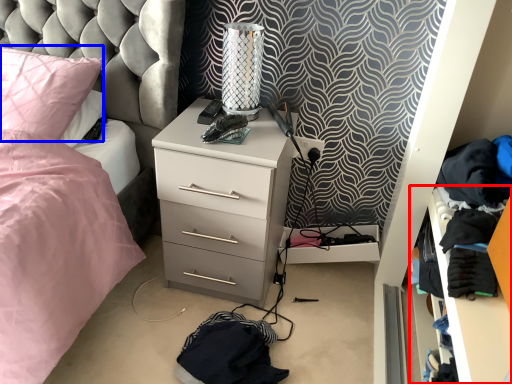
Question: Which point is closer to the camera, shelf (highlighted by a red box) or pillow (highlighted by a blue box)?

Choices:
 (A) shelf
 (B) pillow

Answer: (A)